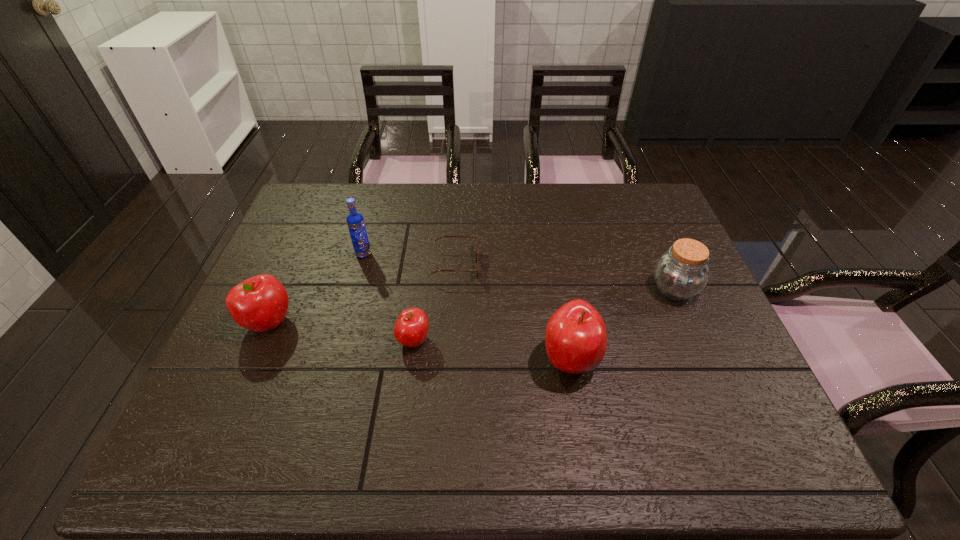
Where is `vacant place for an extra apple on the right`? This screenshot has height=540, width=960. vacant place for an extra apple on the right is located at coordinates (738, 380).